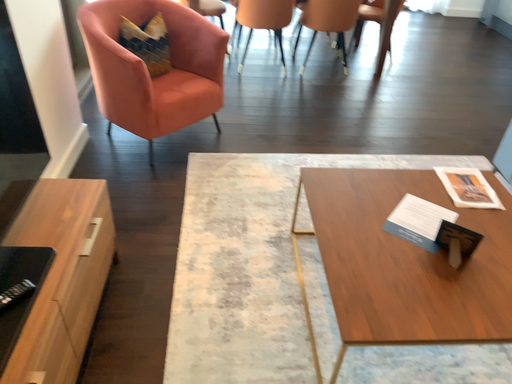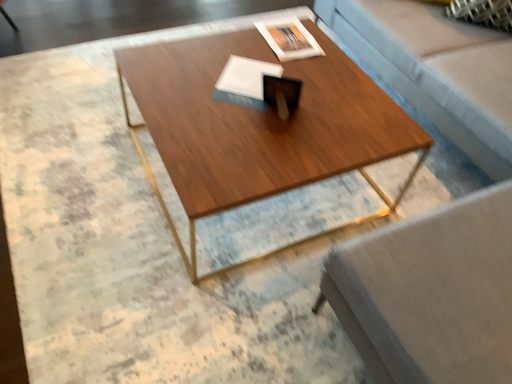
Question: Which way did the camera rotate in the video?

Choices:
 (A) rotated upward
 (B) rotated downward

Answer: (B)